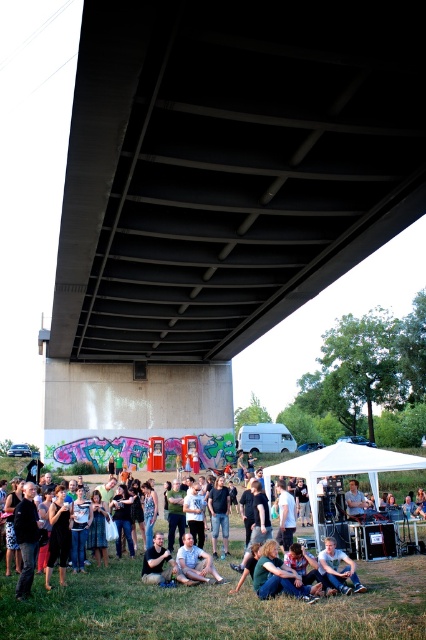
Question: Which object is closer to the camera taking this photo?

Choices:
 (A) denim jeans at lower center
 (B) green fabric shirt at lower center
 (C) dark gray shirt at center
 (D) light brown leather jacket at center

Answer: (C)

Question: Can you confirm if white fabric tent at center is bigger than denim shorts at lower center?

Choices:
 (A) yes
 (B) no

Answer: (A)

Question: Does green grass at lower center appear on the left side of light brown leather jacket at center?

Choices:
 (A) yes
 (B) no

Answer: (A)

Question: Which object is farther from the camera taking this photo?

Choices:
 (A) denim jeans at lower center
 (B) denim shorts at lower center
 (C) green fabric shirt at lower center
 (D) white fabric tent at center

Answer: (D)

Question: Which of the following is the closest to the observer?

Choices:
 (A) (348, 500)
 (B) (317, 480)

Answer: (A)

Question: Considering the relative positions of concrete at center and white fabric tent at center in the image provided, where is concrete at center located with respect to white fabric tent at center?

Choices:
 (A) above
 (B) below

Answer: (A)